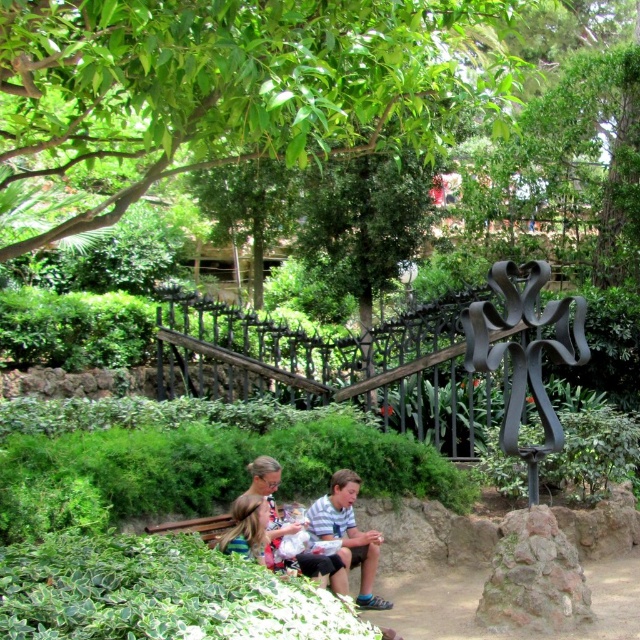
You are a photographer standing in the park and want to take a photo of the striped cotton shirt at center without the green leafy tree at upper center blocking it. How should you adjust your position?

Move your position so that the striped cotton shirt at center is no longer under the green leafy tree at upper center. Since the green leafy tree at upper center is positioned over the striped cotton shirt at center, moving sideways or backward could help avoid the tree blocking the shirt.

You are standing in the park and want to take a photo of the green leafy tree at upper center. Your camera has a maximum focus range of 3 meters. Can you capture the tree clearly without moving closer?

The green leafy tree at upper center is 3.52 meters away from the camera, which exceeds the maximum focus range of 3 meters. Therefore, you cannot capture it clearly without moving closer.